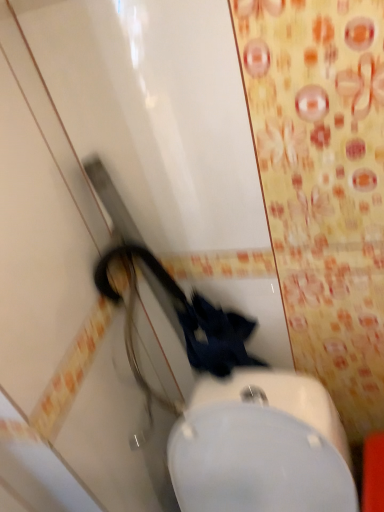
The height and width of the screenshot is (512, 384). Describe the element at coordinates (261, 446) in the screenshot. I see `white glossy toilet at center` at that location.

What is the approximate height of white glossy toilet at center?

The height of white glossy toilet at center is 74.52 centimeters.

Where is `white glossy toilet at center`? Image resolution: width=384 pixels, height=512 pixels. white glossy toilet at center is located at coordinates (261, 446).

Measure the distance between point (285, 446) and camera.

29.72 inches.

In order to face white glossy toilet at center, should I rotate leftwards or rightwards?

You should rotate right by 10.579 degrees.

Measure the distance between white glossy toilet at center and camera.

The distance of white glossy toilet at center from camera is 28.16 inches.

Locate an element on the screen. white glossy toilet at center is located at coordinates (261, 446).